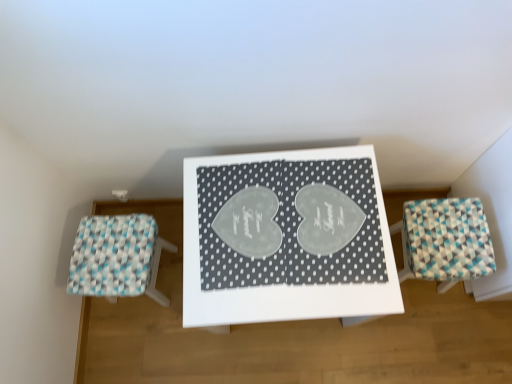
Find the location of a particular element. empty space that is ontop of white glossy table at center (from a real-world perspective) is located at coordinates (283, 230).